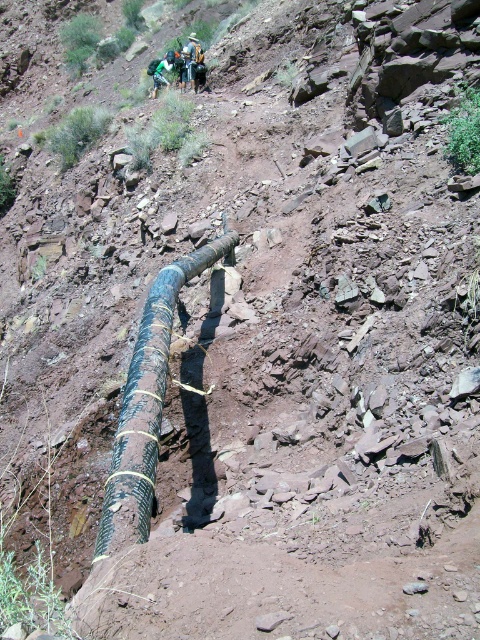
Which is below, brushed metal backpack at upper center or green fabric backpack at center?

green fabric backpack at center is below.

Between brushed metal backpack at upper center and green fabric backpack at center, which one appears on the right side from the viewer's perspective?

brushed metal backpack at upper center

Image resolution: width=480 pixels, height=640 pixels. What do you see at coordinates (190, 60) in the screenshot?
I see `brushed metal backpack at upper center` at bounding box center [190, 60].

Where is `brushed metal backpack at upper center`? The width and height of the screenshot is (480, 640). brushed metal backpack at upper center is located at coordinates (190, 60).

Between black rubber pipe at center and brushed metal backpack at upper center, which one has less height?

black rubber pipe at center

Which is above, black rubber pipe at center or brushed metal backpack at upper center?

brushed metal backpack at upper center is higher up.

The image size is (480, 640). Find the location of `black rubber pipe at center`. black rubber pipe at center is located at coordinates (146, 404).

Does black rubber pipe at center appear over green fabric backpack at center?

No.

Is black rubber pipe at center taller than green fabric backpack at center?

Indeed, black rubber pipe at center has a greater height compared to green fabric backpack at center.

Who is more distant from viewer, (120, 424) or (151, 68)?

The point (151, 68) is more distant.

In order to click on black rubber pipe at center in this screenshot , I will do `click(146, 404)`.